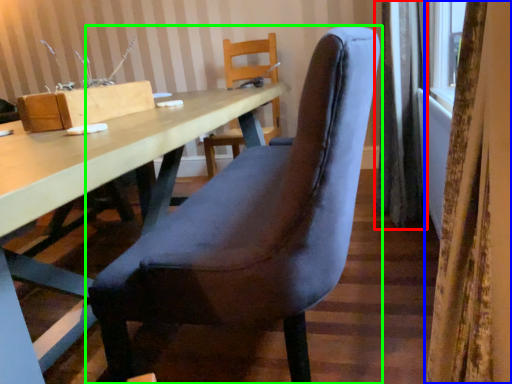
Question: Which is farther away from curtain (highlighted by a red box)? curtain (highlighted by a blue box) or chair (highlighted by a green box)?

Choices:
 (A) curtain
 (B) chair

Answer: (A)